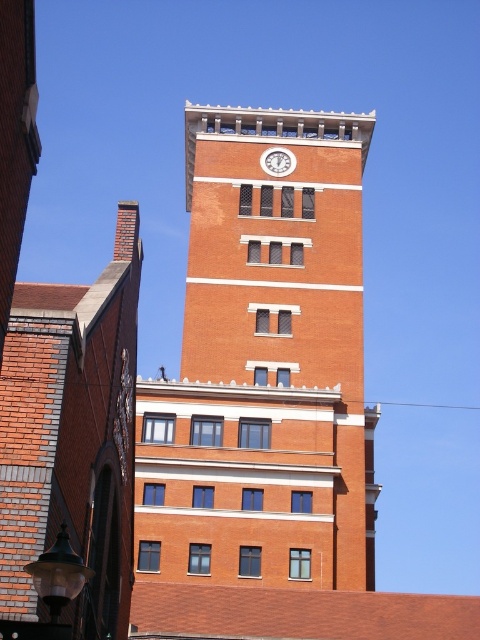
You are a maintenance worker standing at the base of the brick clock tower at center. You need to reach the white glossy clock at upper center for repairs. How far vertically do you need to climb?

The distance between the brick clock tower at center and the white glossy clock at upper center is 13.37 meters, so you need to climb 13.37 meters vertically to reach the white glossy clock at upper center.

You are standing at the camera position looking at the brick clock tower at center. If you walk straight towards it for 150 feet, will you reach the tower?

The brick clock tower at center is 169.47 feet away from the camera. After walking 150 feet, you will still be 19.47 feet away from the tower, so you have not reached it yet.

You are standing in front of a brick building and want to take a photo of the brick clock tower at center and the white glossy clock at upper center. Which object will appear larger in your photo?

The brick clock tower at center will appear larger in the photo because it is closer to the viewer than the white glossy clock at upper center.